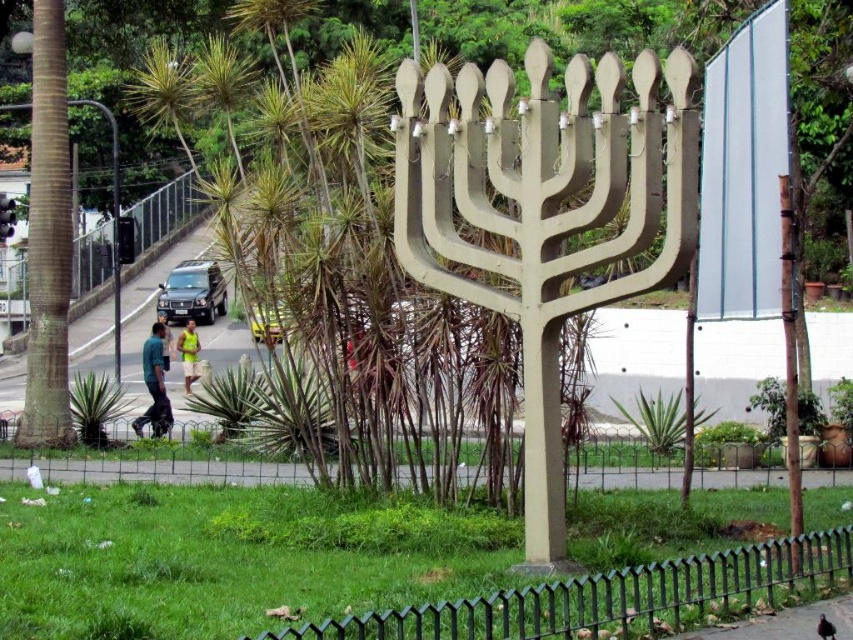
Is point (828, 547) farther from viewer compared to point (177, 346)?

No, it is in front of (177, 346).

Does green metal fence at lower center have a lesser height compared to green fabric shorts at center?

Yes, green metal fence at lower center is shorter than green fabric shorts at center.

Is point (694, 611) farther from camera compared to point (186, 388)?

No, (694, 611) is closer to viewer.

At what (x,y) coordinates should I click in order to perform the action: click on green metal fence at lower center. Please return your answer as a coordinate pair (x, y). This screenshot has width=853, height=640. Looking at the image, I should click on (613, 596).

Looking at this image, between green matte shirt at left and green fabric shorts at center, which one appears on the left side from the viewer's perspective?

green fabric shorts at center

Measure the distance between green matte shirt at left and camera.

The distance of green matte shirt at left from camera is 21.08 meters.

The width and height of the screenshot is (853, 640). Identify the location of green matte shirt at left. (154, 385).

Which is behind, point (624, 596) or point (158, 413)?

The point (158, 413) is more distant.

Where is `green metal fence at lower center`? This screenshot has width=853, height=640. green metal fence at lower center is located at coordinates (613, 596).